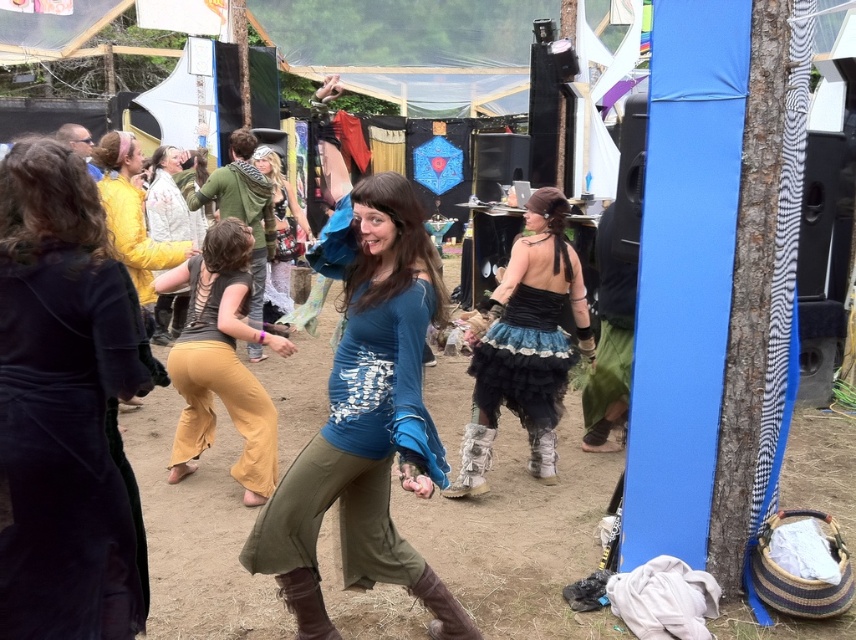
Question: Which point appears closest to the camera in this image?

Choices:
 (A) (253, 500)
 (B) (504, 371)
 (C) (372, 186)
 (D) (551, 419)

Answer: (C)

Question: Which is farther from the black lace dress at center?

Choices:
 (A) matte lace dress at center
 (B) blue cotton shirt at center
 (C) velvet yellow dress at upper left
 (D) black lace skirt at center

Answer: (A)

Question: Can you confirm if velvet yellow dress at upper left is smaller than black lace dress at center?

Choices:
 (A) yes
 (B) no

Answer: (B)

Question: Which object is the closest to the matte brown pants at center?

Choices:
 (A) velvet yellow dress at upper left
 (B) black lace dress at center
 (C) matte lace dress at center

Answer: (B)

Question: Is velvet yellow dress at upper left positioned at the back of matte lace dress at center?

Choices:
 (A) yes
 (B) no

Answer: (B)

Question: Can you confirm if matte brown pants at center is thinner than black lace dress at center?

Choices:
 (A) yes
 (B) no

Answer: (B)